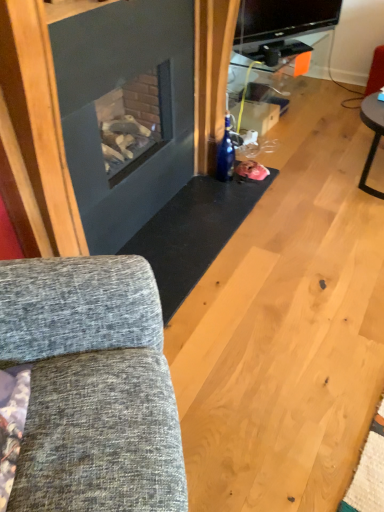
What do you see at coordinates (92, 386) in the screenshot? I see `textured gray fabric couch at left` at bounding box center [92, 386].

Locate an element on the screen. The height and width of the screenshot is (512, 384). textured gray fabric couch at left is located at coordinates (92, 386).

Describe the element at coordinates (267, 70) in the screenshot. The width and height of the screenshot is (384, 512). I see `metallic silver tv stand at upper center` at that location.

The image size is (384, 512). Identify the location of metallic silver tv stand at upper center. (x=267, y=70).

The width and height of the screenshot is (384, 512). I want to click on textured gray fabric couch at left, so click(92, 386).

Is textured gray fabric couch at left at the right side of metallic silver tv stand at upper center?

In fact, textured gray fabric couch at left is to the left of metallic silver tv stand at upper center.

Which object is further away from the camera taking this photo, textured gray fabric couch at left or metallic silver tv stand at upper center?

metallic silver tv stand at upper center is behind.

Is point (122, 509) closer or farther from the camera than point (289, 75)?

Point (122, 509).

From the image's perspective, which object appears higher, textured gray fabric couch at left or metallic silver tv stand at upper center?

metallic silver tv stand at upper center.

From a real-world perspective, which is physically below, textured gray fabric couch at left or metallic silver tv stand at upper center?

metallic silver tv stand at upper center, from a real-world perspective.

Considering the sizes of textured gray fabric couch at left and metallic silver tv stand at upper center in the image, is textured gray fabric couch at left wider or thinner than metallic silver tv stand at upper center?

Clearly, textured gray fabric couch at left has more width compared to metallic silver tv stand at upper center.

Is textured gray fabric couch at left taller or shorter than metallic silver tv stand at upper center?

Considering their sizes, textured gray fabric couch at left has more height than metallic silver tv stand at upper center.

Who is smaller, textured gray fabric couch at left or metallic silver tv stand at upper center?

Smaller between the two is metallic silver tv stand at upper center.

Is textured gray fabric couch at left inside or outside of metallic silver tv stand at upper center?

textured gray fabric couch at left is located beyond the bounds of metallic silver tv stand at upper center.

Are textured gray fabric couch at left and metallic silver tv stand at upper center located far from each other?

Indeed, textured gray fabric couch at left is not near metallic silver tv stand at upper center.

Could you tell me if textured gray fabric couch at left is facing metallic silver tv stand at upper center?

No, textured gray fabric couch at left is not turned towards metallic silver tv stand at upper center.

How distant is textured gray fabric couch at left from metallic silver tv stand at upper center?

They are 2.41 meters apart.

Identify the location of entertainment center that appears below the textured gray fabric couch at left (from a real-world perspective). The image size is (384, 512). (267, 70).

Consider the image. Which object is positioned more to the right, metallic silver tv stand at upper center or textured gray fabric couch at left?

Positioned to the right is metallic silver tv stand at upper center.

Considering the positions of objects metallic silver tv stand at upper center and textured gray fabric couch at left in the image provided, who is behind, metallic silver tv stand at upper center or textured gray fabric couch at left?

metallic silver tv stand at upper center is behind.

Is point (260, 60) more distant than point (149, 440)?

Yes.

From the image's perspective, between metallic silver tv stand at upper center and textured gray fabric couch at left, who is located below?

textured gray fabric couch at left is shown below in the image.

From a real-world perspective, is metallic silver tv stand at upper center over textured gray fabric couch at left?

No.

Between metallic silver tv stand at upper center and textured gray fabric couch at left, which one has larger width?

textured gray fabric couch at left.

Between metallic silver tv stand at upper center and textured gray fabric couch at left, which one has more height?

Standing taller between the two is textured gray fabric couch at left.

Can you confirm if metallic silver tv stand at upper center is smaller than textured gray fabric couch at left?

Yes.

Would you say metallic silver tv stand at upper center is outside textured gray fabric couch at left?

Yes, metallic silver tv stand at upper center is not within textured gray fabric couch at left.

Would you say metallic silver tv stand at upper center is a long distance from textured gray fabric couch at left?

Yes, metallic silver tv stand at upper center and textured gray fabric couch at left are located far from each other.

Is metallic silver tv stand at upper center positioned with its back to textured gray fabric couch at left?

No, metallic silver tv stand at upper center's orientation is not away from textured gray fabric couch at left.

How much distance is there between metallic silver tv stand at upper center and textured gray fabric couch at left?

A distance of 2.41 meters exists between metallic silver tv stand at upper center and textured gray fabric couch at left.

The height and width of the screenshot is (512, 384). Find the location of `entertainment center on the right of textured gray fabric couch at left`. entertainment center on the right of textured gray fabric couch at left is located at coordinates (267, 70).

Image resolution: width=384 pixels, height=512 pixels. I want to click on studio couch on the left side of metallic silver tv stand at upper center, so click(x=92, y=386).

This screenshot has height=512, width=384. What are the coordinates of `entertainment center behind the textured gray fabric couch at left` in the screenshot? It's located at (267, 70).